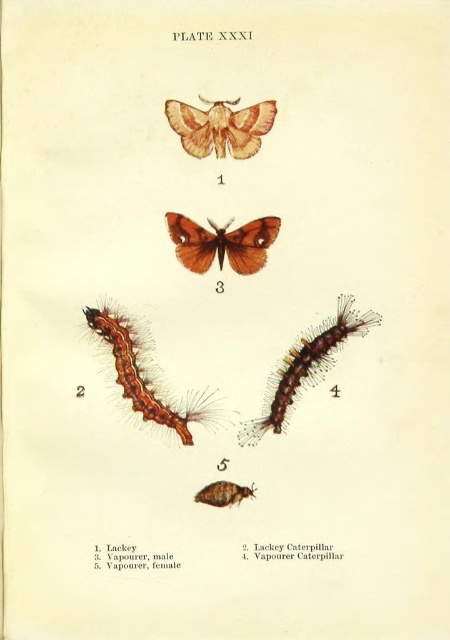
Can you confirm if fuzzy brown caterpillar at center right is thinner than brown fuzzy caterpillar at center?

Incorrect, fuzzy brown caterpillar at center right's width is not less than brown fuzzy caterpillar at center's.

Measure the distance between point (273, 413) and camera.

Point (273, 413) is 1.38 meters away from camera.

Is point (319, 326) less distant than point (210, 493)?

That is False.

Identify the location of fuzzy brown caterpillar at center right. (306, 365).

Between point (115, 340) and point (260, 232), which one is positioned behind?

The point (115, 340) is behind.

Between point (99, 333) and point (193, 250), which one is positioned in front?

Point (193, 250)

Does point (156, 401) come farther from viewer compared to point (261, 259)?

Yes, point (156, 401) is farther from viewer.

You are a GUI agent. You are given a task and a screenshot of the screen. Output one action in this format:
    pyautogui.click(x=<x>, y=<y>)
    Task: Click on the fuzzy brown caterpillar at lower left
    The width and height of the screenshot is (450, 640).
    Given the screenshot: What is the action you would take?
    pyautogui.click(x=144, y=376)

Describe the element at coordinates (220, 125) in the screenshot. I see `brown textured moth at upper center` at that location.

Between point (232, 141) and point (180, 256), which one is positioned behind?

Positioned behind is point (180, 256).

Find the location of a particular element. brown textured moth at upper center is located at coordinates (220, 125).